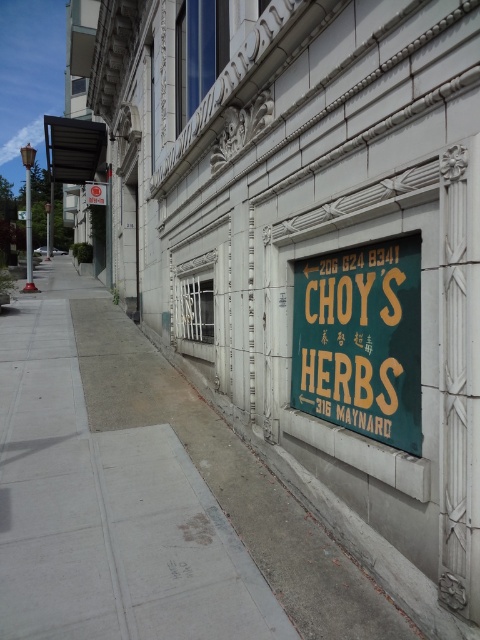
You are a delivery driver who needs to park your vehicle near the gray concrete sidewalk at lower left and the green matte sign at center. According to the scene, which object is positioned to the left of the other?

The gray concrete sidewalk at lower left is to the left of green matte sign at center, so the gray concrete sidewalk at lower left is positioned to the left of the green matte sign at center.

You are a delivery person holding a package for Choy Herbs. You arrive at the building and see the gray concrete sidewalk at lower left and the green matte sign at center. Which object is taller?

The gray concrete sidewalk at lower left is taller than the green matte sign at center.

You are standing at the entrance of the building shown in the image. You notice a point marked at coordinates (146, 497). Where is this point located relative to the building?

The point is on the gray concrete sidewalk at lower left relative to the building.